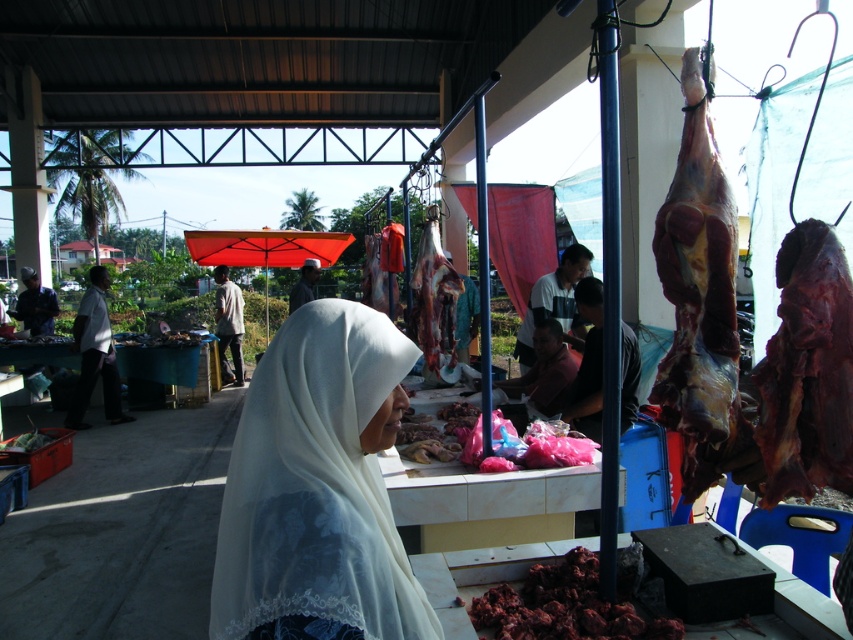
You are a photographer standing at the camera position. You want to take a closeup photo of the dark red meat at lower center. Can you reach it with your camera lens without moving your position? The camera has a maximum zoom of 100mm.

The dark red meat at lower center and camera are 6.48 feet apart from each other. A 100mm lens can focus on objects at that distance, so yes, you can take the closeup photo without moving.

You are a health inspector visiting this market. You notice the raw meat at center and the white matte shirt at center. Given that the minimum safe distance between raw meat and clothing to prevent cross contamination is 3 feet, is the current spacing compliant with safety regulations?

The distance between the raw meat at center and white matte shirt at center is 3.33 feet, which exceeds the minimum required 3 feet, so it is compliant with safety regulations.